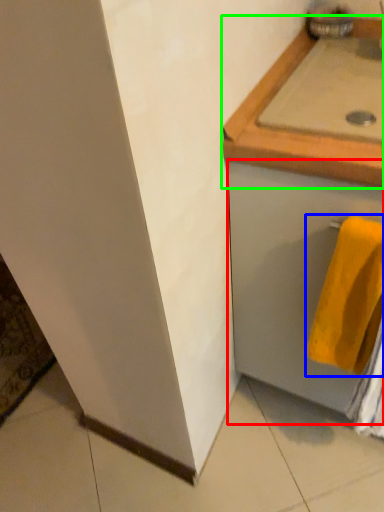
Question: Based on their relative distances, which object is nearer to drawer (highlighted by a red box)? Choose from towel (highlighted by a blue box) and countertop (highlighted by a green box).

Choices:
 (A) towel
 (B) countertop

Answer: (A)